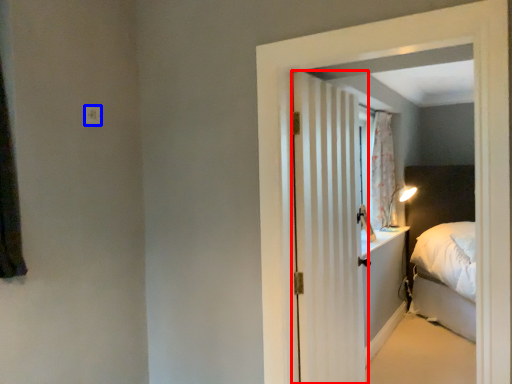
Question: Which point is closer to the camera, door (highlighted by a red box) or electric outlet (highlighted by a blue box)?

Choices:
 (A) door
 (B) electric outlet

Answer: (A)